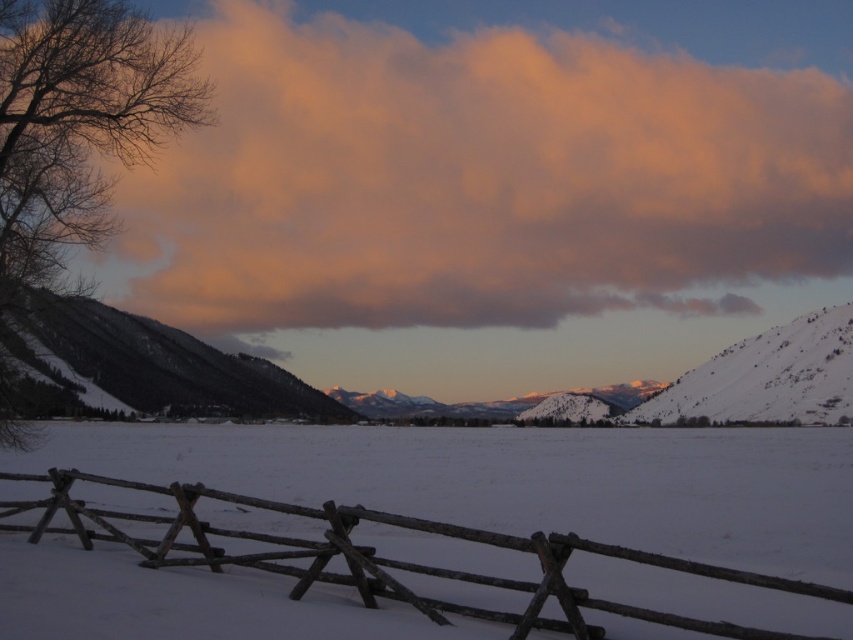
Question: Can you confirm if orange cotton cloud at upper center is positioned to the left of snowy textured mountain at left?

Choices:
 (A) yes
 (B) no

Answer: (B)

Question: Which point is farther to the camera?

Choices:
 (A) (437, 531)
 (B) (155, 241)

Answer: (B)

Question: From the image, what is the correct spatial relationship of brown wooden fence at lower center in relation to snowy textured mountain at left?

Choices:
 (A) left
 (B) right

Answer: (B)

Question: Estimate the real-world distances between objects in this image. Which object is farther from the brown wooden fence at lower center?

Choices:
 (A) orange cotton cloud at upper center
 (B) snowy textured mountain at left

Answer: (A)

Question: Which object is the closest to the brown wooden fence at lower center?

Choices:
 (A) snowy textured mountain at left
 (B) orange cotton cloud at upper center

Answer: (A)

Question: Can you confirm if orange cotton cloud at upper center is positioned to the left of brown wooden fence at lower center?

Choices:
 (A) yes
 (B) no

Answer: (B)